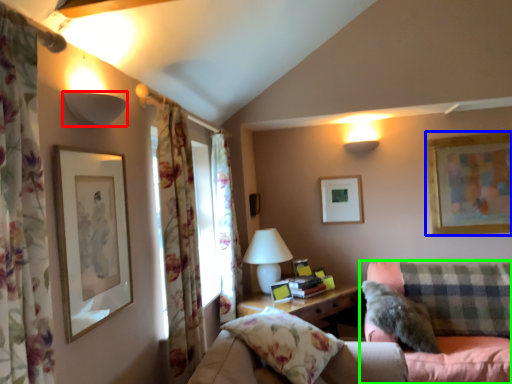
Question: Which is farther away from lamp (highlighted by a red box)? picture frame (highlighted by a blue box) or studio couch (highlighted by a green box)?

Choices:
 (A) picture frame
 (B) studio couch

Answer: (A)